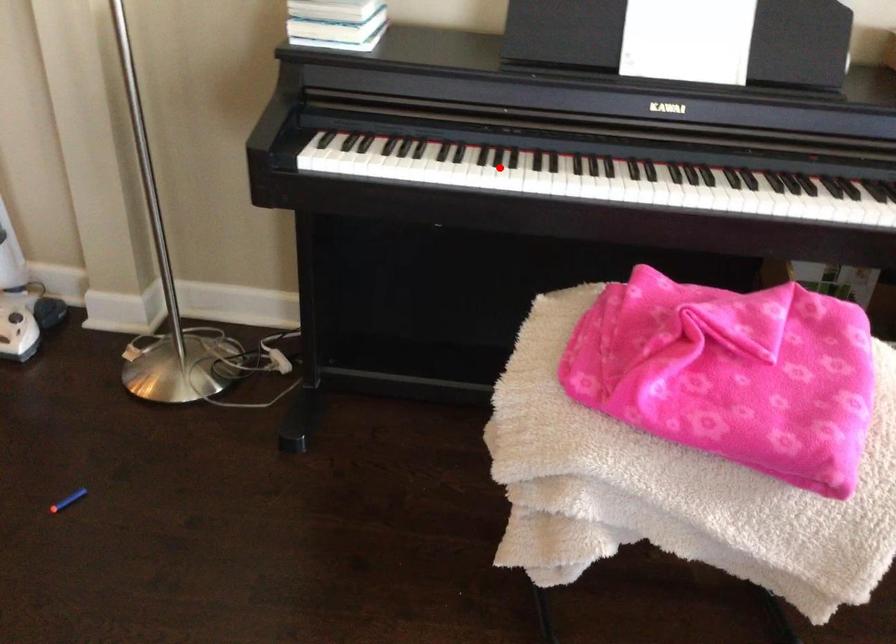
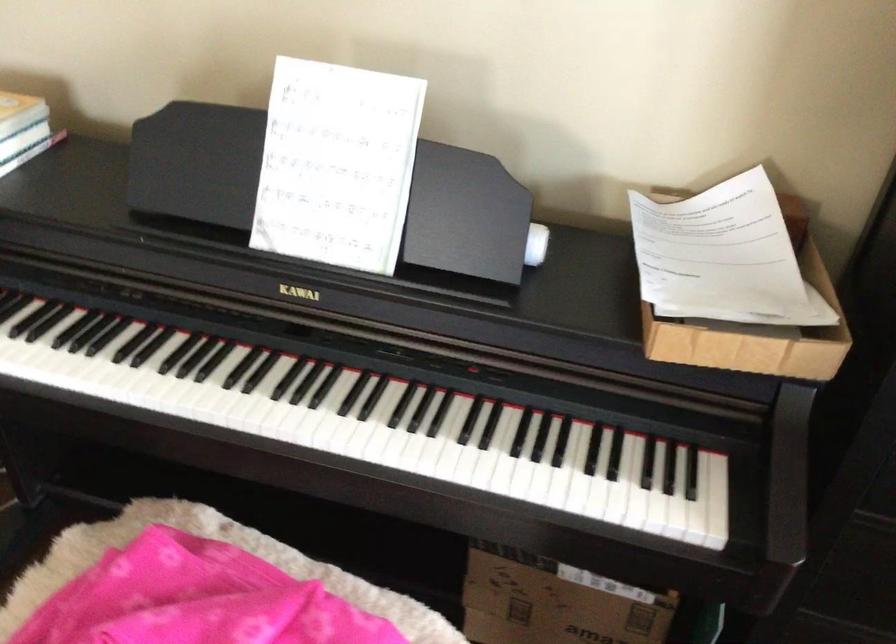
Question: I am providing you with two images of the same scene from different viewpoints. A red point is marked on the first image. Can you still see the location of the red point in image 2?

Choices:
 (A) Yes
 (B) No

Answer: (A)